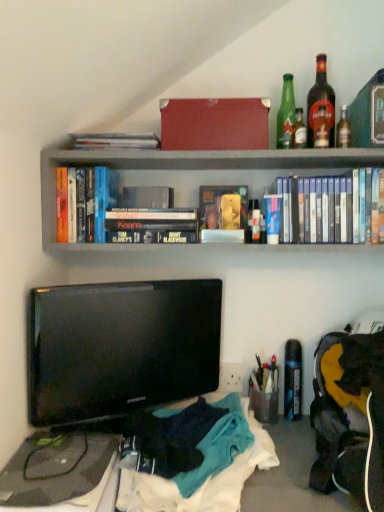
This screenshot has width=384, height=512. I want to click on hardcover book at upper right, which ranks as the fourth paperback book in left-to-right order, so click(x=368, y=114).

The image size is (384, 512). What do you see at coordinates (120, 347) in the screenshot?
I see `black glossy tv at lower left` at bounding box center [120, 347].

Based on the photo, in order to face blue matte book at center, the 2th paperback book in the right-to-left sequence, should I rotate leftwards or rightwards?

Rotate right and turn 10.564 degrees.

Measure the distance between green glass bottle at upper right, positioned as the 2th bottle in left-to-right order, and camera.

1.11 meters.

The width and height of the screenshot is (384, 512). In order to click on black matte dvd case at upper center, which is counted as the 1th book, starting from the right in this screenshot , I will do `click(337, 208)`.

Where is `hardcover book at upper right, the 1th paperback book viewed from the right`? hardcover book at upper right, the 1th paperback book viewed from the right is located at coordinates (368, 114).

Which paperback book is the 4th one when counting from the front of the green glass bottle at upper right, marked as the 4th bottle in a right-to-left arrangement? Please provide its 2D coordinates.

[(368, 114)]

Which object is further away from the camera taking this photo, green glass bottle at upper right, marked as the 4th bottle in a right-to-left arrangement, or hardcover book at upper right, the 1th paperback book viewed from the right?

Positioned behind is green glass bottle at upper right, marked as the 4th bottle in a right-to-left arrangement.

From a real-world perspective, is green glass bottle at upper right, marked as the 4th bottle in a right-to-left arrangement, above or below hardcover book at upper right, the 1th paperback book viewed from the right?

From a real-world perspective, green glass bottle at upper right, marked as the 4th bottle in a right-to-left arrangement, is physically above hardcover book at upper right, the 1th paperback book viewed from the right.

Is green glass bottle at upper right, marked as the 4th bottle in a right-to-left arrangement, completely or partially outside of hardcover book at upper right, the 1th paperback book viewed from the right?

Yes.

Is green glass bottle at upper right, marked as the 4th bottle in a right-to-left arrangement, oriented away from black plastic desktop at lower left?

No.

From a real-world perspective, is green glass bottle at upper right, marked as the 4th bottle in a right-to-left arrangement, on black plastic desktop at lower left?

Yes, from a real-world perspective, green glass bottle at upper right, marked as the 4th bottle in a right-to-left arrangement, is over black plastic desktop at lower left

How many degrees apart are the facing directions of green glass bottle at upper right, marked as the 4th bottle in a right-to-left arrangement, and black plastic desktop at lower left?

There is a 1.22-degree angle between the facing directions of green glass bottle at upper right, marked as the 4th bottle in a right-to-left arrangement, and black plastic desktop at lower left.

Is green glass bottle at upper right, marked as the 4th bottle in a right-to-left arrangement, taller or shorter than black plastic desktop at lower left?

In the image, green glass bottle at upper right, marked as the 4th bottle in a right-to-left arrangement, appears to be taller than black plastic desktop at lower left.

Is the position of knitted wool sweater at lower center less distant than that of black plastic desktop at lower left?

Yes, the depth of knitted wool sweater at lower center is less than that of black plastic desktop at lower left.

How many degrees apart are the facing directions of knitted wool sweater at lower center and black plastic desktop at lower left?

They differ by 0.599 degrees in their facing directions.

Can we say knitted wool sweater at lower center lies outside black plastic desktop at lower left?

Indeed, knitted wool sweater at lower center is completely outside black plastic desktop at lower left.

From a real-world perspective, is knitted wool sweater at lower center beneath black plastic desktop at lower left?

No, from a real-world perspective, knitted wool sweater at lower center is not below black plastic desktop at lower left.

Between point (361, 143) and point (169, 167), which one is positioned in front?

The point (361, 143) is closer.

Could you measure the distance between hardcover book at upper right, the 1th paperback book viewed from the right, and hardcover books at upper center?

10.17 inches.

Is hardcover book at upper right, the 1th paperback book viewed from the right, bigger than hardcover books at upper center?

Incorrect, hardcover book at upper right, the 1th paperback book viewed from the right, is not larger than hardcover books at upper center.

There is a hardcover book at upper left, which is the first book in left-to-right order. Where is `the 1st paperback book above it (from the image's perspective)`? the 1st paperback book above it (from the image's perspective) is located at coordinates (147, 197).

Based on their sizes in the image, would you say hardcover book at upper center, which is counted as the fourth paperback book, starting from the right, is bigger or smaller than hardcover book at upper left, which is the first book in left-to-right order?

Considering their sizes, hardcover book at upper center, which is counted as the fourth paperback book, starting from the right, takes up less space than hardcover book at upper left, which is the first book in left-to-right order.

Are hardcover book at upper center, which appears as the first paperback book when viewed from the left, and hardcover book at upper left, which ranks as the 3th book in right-to-left order, beside each other?

They are not placed beside each other.

From the image's perspective, relative to hardcover book at upper left, which is the first book in left-to-right order, is hardcover book at upper center, which is counted as the fourth paperback book, starting from the right, above or below?

Clearly, from the image's perspective, hardcover book at upper center, which is counted as the fourth paperback book, starting from the right, is above hardcover book at upper left, which is the first book in left-to-right order.

From the image's perspective, is hardcover book at upper left, which ranks as the 3th book in right-to-left order, above or below green glass bottle at upper right, positioned as the 2th bottle in left-to-right order?

hardcover book at upper left, which ranks as the 3th book in right-to-left order, is situated lower than green glass bottle at upper right, positioned as the 2th bottle in left-to-right order, in the image.

Which of these two, hardcover book at upper left, which is the first book in left-to-right order, or green glass bottle at upper right, which is counted as the third bottle, starting from the right, is wider?

hardcover book at upper left, which is the first book in left-to-right order.

Who is smaller, hardcover book at upper left, which is the first book in left-to-right order, or green glass bottle at upper right, positioned as the 2th bottle in left-to-right order?

Smaller between the two is green glass bottle at upper right, positioned as the 2th bottle in left-to-right order.

Looking at this image, from a real-world perspective, between hardcover book at upper left, which ranks as the 3th book in right-to-left order, and green glass bottle at upper right, which is counted as the third bottle, starting from the right, who is vertically higher?

From a 3D spatial view, green glass bottle at upper right, which is counted as the third bottle, starting from the right, is above.

Is hardcover book at upper left, which ranks as the 3th book in right-to-left order, positioned beyond the bounds of black plastic desktop at lower left?

Yes, hardcover book at upper left, which ranks as the 3th book in right-to-left order, is located beyond the bounds of black plastic desktop at lower left.

From the picture: How different are the orientations of hardcover book at upper left, which is the first book in left-to-right order, and black plastic desktop at lower left in degrees?

The angular difference between hardcover book at upper left, which is the first book in left-to-right order, and black plastic desktop at lower left is 3.1 degrees.

Does hardcover book at upper left, which ranks as the 3th book in right-to-left order, appear on the right side of black plastic desktop at lower left?

No, hardcover book at upper left, which ranks as the 3th book in right-to-left order, is not to the right of black plastic desktop at lower left.

Which point is more forward, (59, 174) or (45, 489)?

The point (45, 489) is closer to the camera.

Identify the location of bottle that is the 4th one when counting backward from the hardcover book at upper right, the 1th paperback book viewed from the right. This screenshot has height=512, width=384. (286, 114).

At what (x,y) coordinates should I click in order to perform the action: click on desktop lying on the left of green glass bottle at upper right, placed as the 1th bottle when sorted from left to right. Please return your answer as a coordinate pair (x, y). The height and width of the screenshot is (512, 384). Looking at the image, I should click on (58, 477).

From the image, which object appears to be farther from matte red box at upper center, black glossy tv at lower left or hardcover book at upper left, which ranks as the 3th book in right-to-left order?

black glossy tv at lower left.

Considering their positions, is blue matte book at center, the 2th paperback book in the right-to-left sequence, positioned closer to hardcover books at upper center than hardcover book at upper left, which ranks as the 3th book in right-to-left order?

Among the two, hardcover book at upper left, which ranks as the 3th book in right-to-left order, is located nearer to hardcover books at upper center.

Estimate the real-world distances between objects in this image. Which object is further from black matte dvd case at upper center, which is counted as the 1th book, starting from the right, hardcover books at upper center or hardcover book at upper left, which is the first book in left-to-right order?

Among the two, hardcover book at upper left, which is the first book in left-to-right order, is located further to black matte dvd case at upper center, which is counted as the 1th book, starting from the right.

Looking at the image, which one is located closer to blue matte book at center, which appears as the third paperback book when viewed from the left, hardcover book at upper center, which appears as the first paperback book when viewed from the left, or hardcover book at upper left, which is the first book in left-to-right order?

hardcover book at upper center, which appears as the first paperback book when viewed from the left.

Considering their positions, is knitted wool sweater at lower center positioned further to black plastic desktop at lower left than dark amber glass bottle at upper right, which appears as the 2th bottle when viewed from the right?

dark amber glass bottle at upper right, which appears as the 2th bottle when viewed from the right, is further to black plastic desktop at lower left.

Considering their positions, is hardcover book at center, the 3th paperback book in the right-to-left sequence, positioned closer to black matte dvd case at upper center, marked as the third book in a left-to-right arrangement, than blue matte book at center, the 2th paperback book in the right-to-left sequence?

Among the two, blue matte book at center, the 2th paperback book in the right-to-left sequence, is located nearer to black matte dvd case at upper center, marked as the third book in a left-to-right arrangement.

From the image, which object appears to be farther from dark amber glass bottle at upper right, which appears as the 2th bottle when viewed from the right, hardcover book at center, the 3th paperback book in the right-to-left sequence, or blue matte book at center, which appears as the third paperback book when viewed from the left?

Among the two, hardcover book at center, the 3th paperback book in the right-to-left sequence, is located further to dark amber glass bottle at upper right, which appears as the 2th bottle when viewed from the right.

Based on their spatial positions, is hardcover book at center, the 3th paperback book in the right-to-left sequence, or hardcover books at upper center closer to hardcover book at upper right, the 1th paperback book viewed from the right?

Based on the image, hardcover books at upper center appears to be nearer to hardcover book at upper right, the 1th paperback book viewed from the right.

At what (x,y) coordinates should I click in order to perform the action: click on shelf between hardcover book at upper center, the 2th book when ordered from right to left, and knitted wool sweater at lower center from top to bottom. Please return your answer as a coordinate pair (x, y). The height and width of the screenshot is (512, 384). Looking at the image, I should click on (190, 166).

The image size is (384, 512). In order to click on shelf between matte red box at upper center and green glass bottle at upper right, placed as the 1th bottle when sorted from right to left, in the horizontal direction in this screenshot , I will do `click(190, 166)`.

This screenshot has height=512, width=384. Identify the location of bottle between green glass bottle at upper right, which appears as the 4th bottle when viewed from the left, and blue matte book at center, which appears as the third paperback book when viewed from the left, in the up-down direction. (299, 130).

Where is `shelf between hardcover book at upper left, which is the first book in left-to-right order, and green glass bottle at upper right, positioned as the 2th bottle in left-to-right order`? This screenshot has width=384, height=512. shelf between hardcover book at upper left, which is the first book in left-to-right order, and green glass bottle at upper right, positioned as the 2th bottle in left-to-right order is located at coordinates (190, 166).